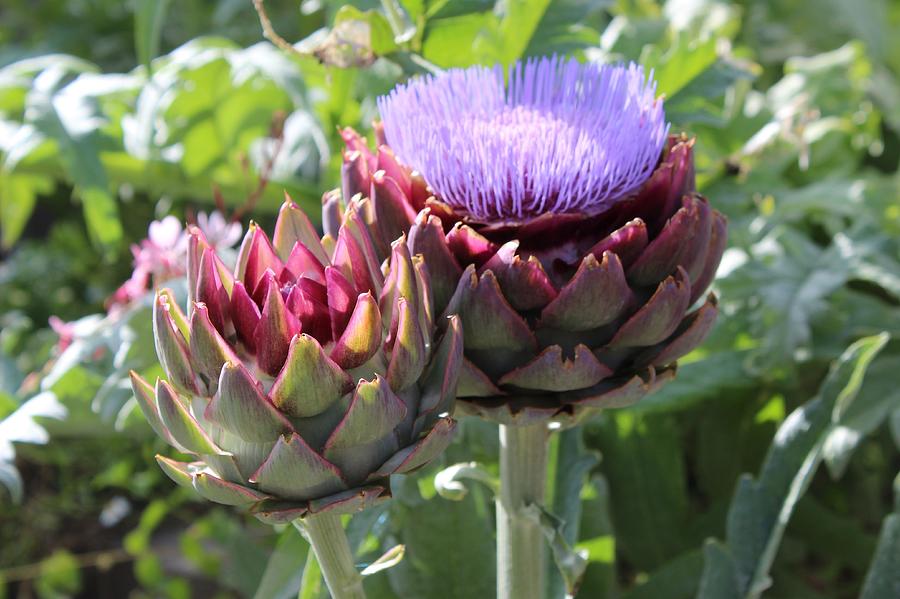
Where is `green pedestals`? green pedestals is located at coordinates coord(250,418).